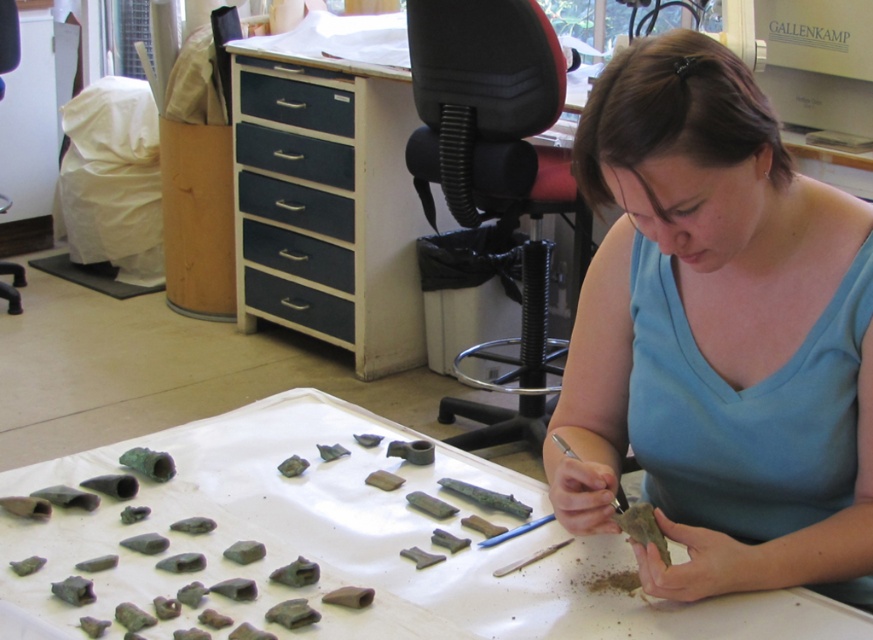
Does blue/grey wood drawer at center appear on the left side of blue painted wood drawer at center?

Incorrect, blue/grey wood drawer at center is not on the left side of blue painted wood drawer at center.

Which is in front, point (243, 193) or point (321, 292)?

Point (321, 292) is in front.

Locate an element on the screen. The image size is (873, 640). blue/grey wood drawer at center is located at coordinates [296, 205].

Find the location of a particular element. The image size is (873, 640). blue/grey wood drawer at center is located at coordinates (296, 205).

Which is below, green stone artifacts at center or blue/grey wood drawer at center?

Positioned lower is green stone artifacts at center.

Does green stone artifacts at center appear on the left side of blue/grey wood drawer at center?

In fact, green stone artifacts at center is to the right of blue/grey wood drawer at center.

Does point (559, 538) come in front of point (301, 209)?

Yes, it is in front of point (301, 209).

This screenshot has height=640, width=873. What are the coordinates of `green stone artifacts at center` in the screenshot? It's located at (361, 541).

Is blue fabric at center positioned before blue matte drawer at center?

Yes.

Which is below, blue fabric at center or blue matte drawer at center?

blue fabric at center

Is point (720, 284) in front of point (241, 122)?

Yes, it is in front of point (241, 122).

At what (x,y) coordinates should I click in order to perform the action: click on blue fabric at center. Please return your answer as a coordinate pair (x, y). This screenshot has width=873, height=640. Looking at the image, I should click on (718, 336).